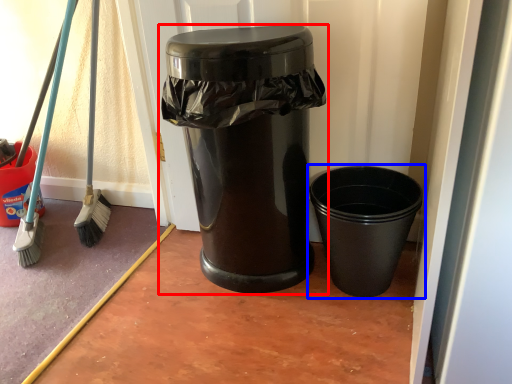
Question: Which point is closer to the camera, waste container (highlighted by a red box) or waste container (highlighted by a blue box)?

Choices:
 (A) waste container
 (B) waste container

Answer: (A)